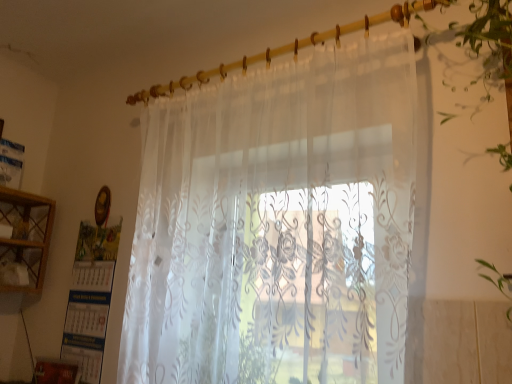
Question: From a real-world perspective, does translucent floral-patterned curtain at center sit lower than wooden cabinet at left?

Choices:
 (A) yes
 (B) no

Answer: (B)

Question: Considering the relative sizes of translucent floral-patterned curtain at center and wooden cabinet at left in the image provided, is translucent floral-patterned curtain at center bigger than wooden cabinet at left?

Choices:
 (A) no
 (B) yes

Answer: (B)

Question: Is translucent floral-patterned curtain at center turned away from wooden cabinet at left?

Choices:
 (A) yes
 (B) no

Answer: (B)

Question: From the image's perspective, does translucent floral-patterned curtain at center appear lower than wooden cabinet at left?

Choices:
 (A) no
 (B) yes

Answer: (A)

Question: Does translucent floral-patterned curtain at center have a greater height compared to wooden cabinet at left?

Choices:
 (A) no
 (B) yes

Answer: (B)

Question: From a real-world perspective, is translucent floral-patterned curtain at center above or below translucent floral curtain at right?

Choices:
 (A) below
 (B) above

Answer: (A)

Question: In terms of height, does translucent floral-patterned curtain at center look taller or shorter compared to translucent floral curtain at right?

Choices:
 (A) short
 (B) tall

Answer: (B)

Question: From the image's perspective, relative to translucent floral curtain at right, is translucent floral-patterned curtain at center above or below?

Choices:
 (A) below
 (B) above

Answer: (A)

Question: Based on their positions, is translucent floral-patterned curtain at center located to the left or right of translucent floral curtain at right?

Choices:
 (A) left
 (B) right

Answer: (A)

Question: Does point (479, 34) appear closer or farther from the camera than point (42, 226)?

Choices:
 (A) closer
 (B) farther

Answer: (A)

Question: Choose the correct answer: Is translucent floral curtain at right inside wooden cabinet at left or outside it?

Choices:
 (A) outside
 (B) inside

Answer: (A)

Question: From the image's perspective, is translucent floral curtain at right located above or below wooden cabinet at left?

Choices:
 (A) above
 (B) below

Answer: (A)

Question: Considering their positions, is translucent floral curtain at right located in front of or behind wooden cabinet at left?

Choices:
 (A) behind
 (B) front

Answer: (B)

Question: Do you think wooden cabinet at left is within translucent floral-patterned curtain at center, or outside of it?

Choices:
 (A) outside
 (B) inside

Answer: (A)

Question: Is wooden cabinet at left in front of or behind translucent floral-patterned curtain at center in the image?

Choices:
 (A) behind
 (B) front

Answer: (A)